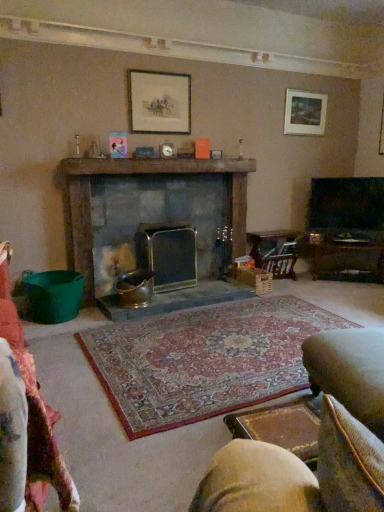
Question: Should I look upward or downward to see wooden magazine rack at center-right?

Choices:
 (A) up
 (B) down

Answer: (A)

Question: Is matte wooden picture frame at upper center, which is the second picture frame in right-to-left order, looking in the opposite direction of metallic silver fireplace at center, the second fireplace viewed from the left?

Choices:
 (A) yes
 (B) no

Answer: (B)

Question: Are matte wooden picture frame at upper center, which is the second picture frame in right-to-left order, and metallic silver fireplace at center, the second fireplace viewed from the left, beside each other?

Choices:
 (A) no
 (B) yes

Answer: (A)

Question: Does matte wooden picture frame at upper center, arranged as the first picture frame when viewed from the front, lie in front of metallic silver fireplace at center, which is counted as the 1th fireplace, starting from the right?

Choices:
 (A) no
 (B) yes

Answer: (B)

Question: Does matte wooden picture frame at upper center, the first picture frame positioned from the left, have a lesser height compared to metallic silver fireplace at center, which is counted as the 1th fireplace, starting from the right?

Choices:
 (A) no
 (B) yes

Answer: (B)

Question: Considering the relative positions of matte wooden picture frame at upper center, the second picture frame viewed from the back, and metallic silver fireplace at center, which is counted as the 1th fireplace, starting from the right, in the image provided, is matte wooden picture frame at upper center, the second picture frame viewed from the back, behind metallic silver fireplace at center, which is counted as the 1th fireplace, starting from the right,?

Choices:
 (A) no
 (B) yes

Answer: (A)

Question: Is matte wooden picture frame at upper center, the second picture frame viewed from the back, taller than metallic silver fireplace at center, the second fireplace viewed from the left?

Choices:
 (A) yes
 (B) no

Answer: (B)

Question: Can you confirm if leather cushioned swivel chair at lower right, arranged as the 2th swivel chair when viewed from the back, is taller than matte wooden picture frame at upper right, which is the 2th picture frame in left-to-right order?

Choices:
 (A) yes
 (B) no

Answer: (A)

Question: Is matte wooden picture frame at upper right, which is the 2th picture frame in left-to-right order, located within leather cushioned swivel chair at lower right, positioned as the second swivel chair in right-to-left order?

Choices:
 (A) yes
 (B) no

Answer: (B)

Question: Does leather cushioned swivel chair at lower right, the first swivel chair from the front, have a greater width compared to matte wooden picture frame at upper right, which is counted as the 2th picture frame, starting from the front?

Choices:
 (A) yes
 (B) no

Answer: (A)

Question: From a real-world perspective, is leather cushioned swivel chair at lower right, the 1th swivel chair from the left, beneath matte wooden picture frame at upper right, which is the 2th picture frame in left-to-right order?

Choices:
 (A) yes
 (B) no

Answer: (A)

Question: Is leather cushioned swivel chair at lower right, the first swivel chair from the front, aimed at matte wooden picture frame at upper right, the 1th picture frame viewed from the back?

Choices:
 (A) yes
 (B) no

Answer: (B)

Question: From a real-world perspective, is leather cushioned swivel chair at lower right, positioned as the second swivel chair in right-to-left order, over matte wooden picture frame at upper right, the 1th picture frame viewed from the back?

Choices:
 (A) yes
 (B) no

Answer: (B)

Question: Can you confirm if velvet beige swivel chair at lower right, placed as the 1th swivel chair when sorted from right to left, is positioned to the right of metallic silver fireplace at center, the second fireplace viewed from the left?

Choices:
 (A) no
 (B) yes

Answer: (B)